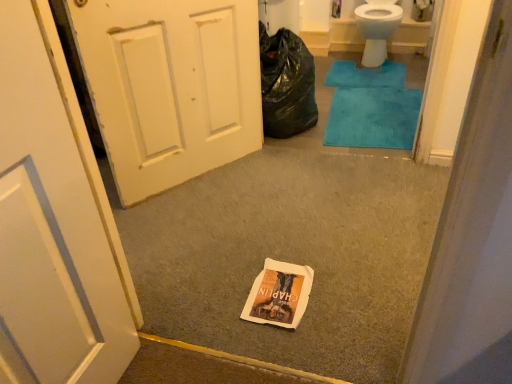
Question: Considering the positions of blue plush bath mat at upper right, the first bath mat in the back-to-front sequence, and black plastic bag at upper right in the image, is blue plush bath mat at upper right, the first bath mat in the back-to-front sequence, wider or thinner than black plastic bag at upper right?

Choices:
 (A) thin
 (B) wide

Answer: (B)

Question: Based on their positions, is blue plush bath mat at upper right, positioned as the second bath mat in bottom-to-top order, located to the left or right of black plastic bag at upper right?

Choices:
 (A) right
 (B) left

Answer: (A)

Question: Which object is positioned closest to the white paper bag at center?

Choices:
 (A) teal plush bath mat at center, positioned as the first bath mat in front-to-back order
 (B) blue plush bath mat at upper right, the first bath mat in the back-to-front sequence
 (C) black plastic bag at upper right
 (D) white glossy porcelain toilet at upper right
 (E) white painted wood door at left

Answer: (E)

Question: Which of these objects is positioned farthest from the blue plush bath mat at upper right, the 2th bath mat positioned from the front?

Choices:
 (A) white painted wood door at left
 (B) white glossy porcelain toilet at upper right
 (C) black plastic bag at upper right
 (D) teal plush bath mat at center, the second bath mat viewed from the top
 (E) white paper bag at center

Answer: (E)